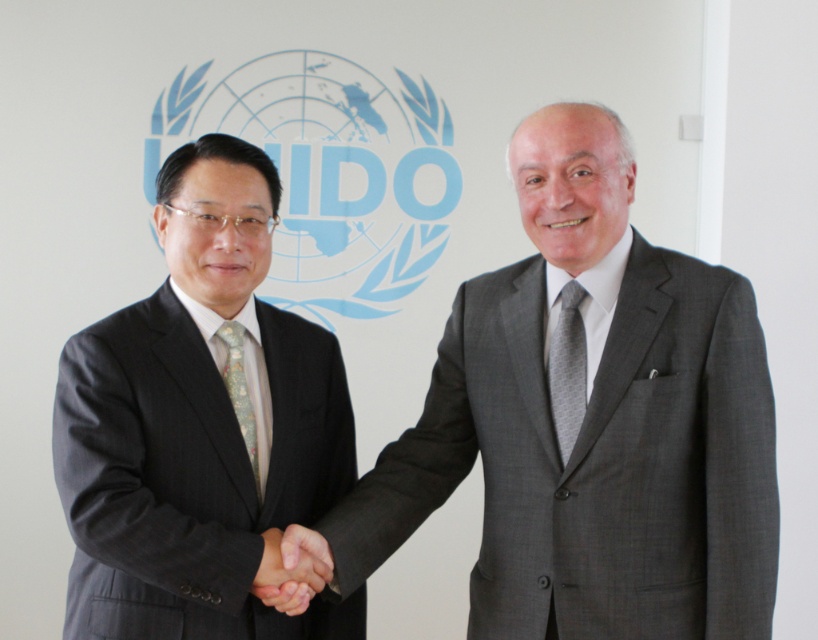
Is point (268, 529) positioned behind point (569, 408)?

Yes, it is behind point (569, 408).

Does black matte hand at center have a larger size compared to gray textured tie at center?

Indeed, black matte hand at center has a larger size compared to gray textured tie at center.

Is point (309, 584) more distant than point (560, 353)?

No, it is not.

You are a GUI agent. You are given a task and a screenshot of the screen. Output one action in this format:
    pyautogui.click(x=<x>, y=<y>)
    Task: Click on the black matte hand at center
    This screenshot has width=818, height=640.
    Given the screenshot: What is the action you would take?
    pyautogui.click(x=291, y=568)

Consider the image. Does matte black suit at left lie behind gray textured tie at center?

No, matte black suit at left is closer to the viewer.

Between matte black suit at left and gray textured tie at center, which one is positioned lower?

matte black suit at left is lower down.

Which is in front, point (284, 432) or point (558, 396)?

Point (558, 396) is in front.

You are a GUI agent. You are given a task and a screenshot of the screen. Output one action in this format:
    pyautogui.click(x=<x>, y=<y>)
    Task: Click on the matte black suit at left
    Image resolution: width=818 pixels, height=640 pixels.
    Given the screenshot: What is the action you would take?
    pyautogui.click(x=199, y=424)

Can you confirm if black matte hand at center is shorter than light blue floral silk tie at center?

Yes, black matte hand at center is shorter than light blue floral silk tie at center.

Is black matte hand at center to the left of light blue floral silk tie at center from the viewer's perspective?

Incorrect, black matte hand at center is not on the left side of light blue floral silk tie at center.

The width and height of the screenshot is (818, 640). I want to click on black matte hand at center, so click(291, 568).

Find the location of a particular element. The width and height of the screenshot is (818, 640). black matte hand at center is located at coordinates (291, 568).